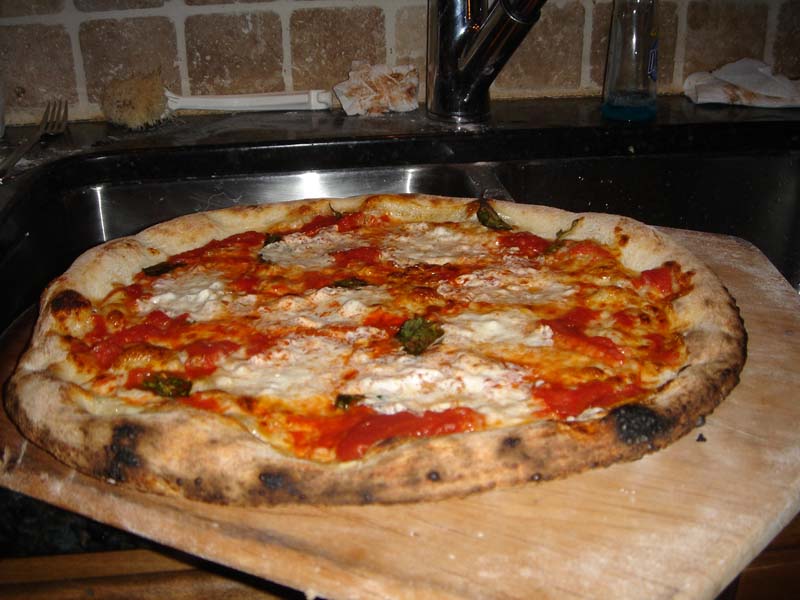
Image resolution: width=800 pixels, height=600 pixels. What are the coordinates of `soap dispenser for dish soap` in the screenshot? It's located at (640, 69).